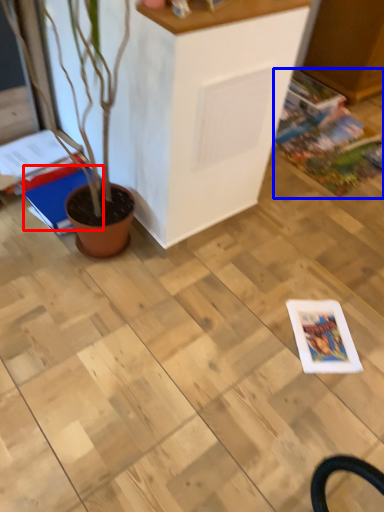
Question: Which of the following is the closest to the observer, magazine (highlighted by a red box) or comic book (highlighted by a blue box)?

Choices:
 (A) magazine
 (B) comic book

Answer: (A)